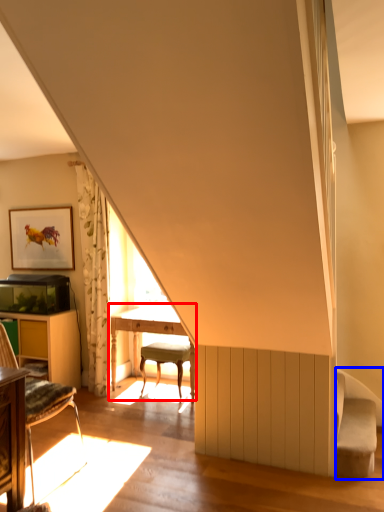
Question: Which of the following is the farthest to the observer, table (highlighted by a red box) or swivel chair (highlighted by a blue box)?

Choices:
 (A) table
 (B) swivel chair

Answer: (A)